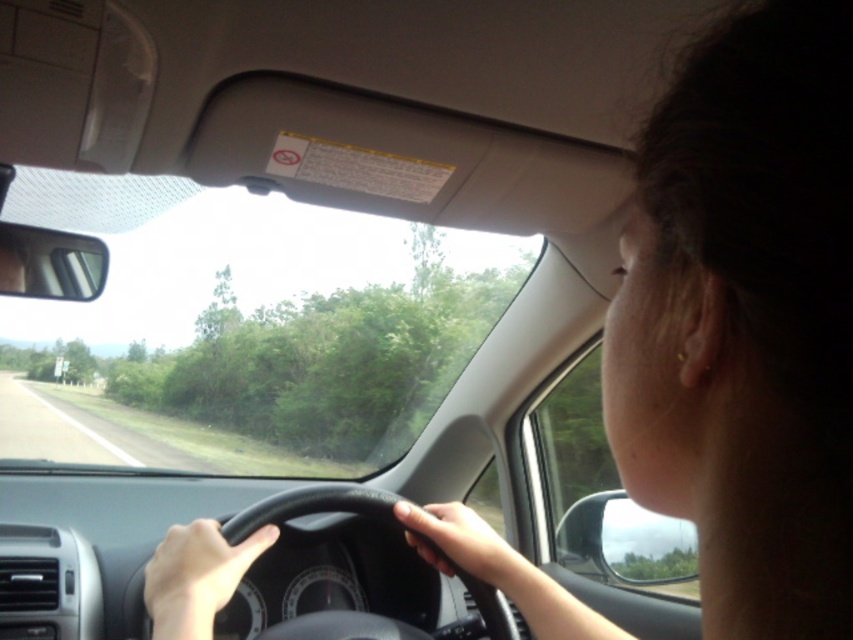
Question: Can you confirm if black leather steering wheel at center is thinner than smooth skin hand at lower left?

Choices:
 (A) no
 (B) yes

Answer: (A)

Question: Is black leather steering wheel at center above smooth skin hand at lower left?

Choices:
 (A) yes
 (B) no

Answer: (B)

Question: Considering the real-world distances, which object is farthest from the smooth skin hand at lower left?

Choices:
 (A) black leather steering wheel at center
 (B) smooth skin hand at center

Answer: (B)

Question: Considering the real-world distances, which object is farthest from the smooth skin hand at center?

Choices:
 (A) smooth skin hand at lower left
 (B) black leather steering wheel at center

Answer: (A)

Question: Which object appears closest to the camera in this image?

Choices:
 (A) smooth skin hand at center
 (B) black leather steering wheel at center

Answer: (A)

Question: Considering the relative positions of black leather steering wheel at center and smooth skin hand at lower left in the image provided, where is black leather steering wheel at center located with respect to smooth skin hand at lower left?

Choices:
 (A) above
 (B) below

Answer: (B)